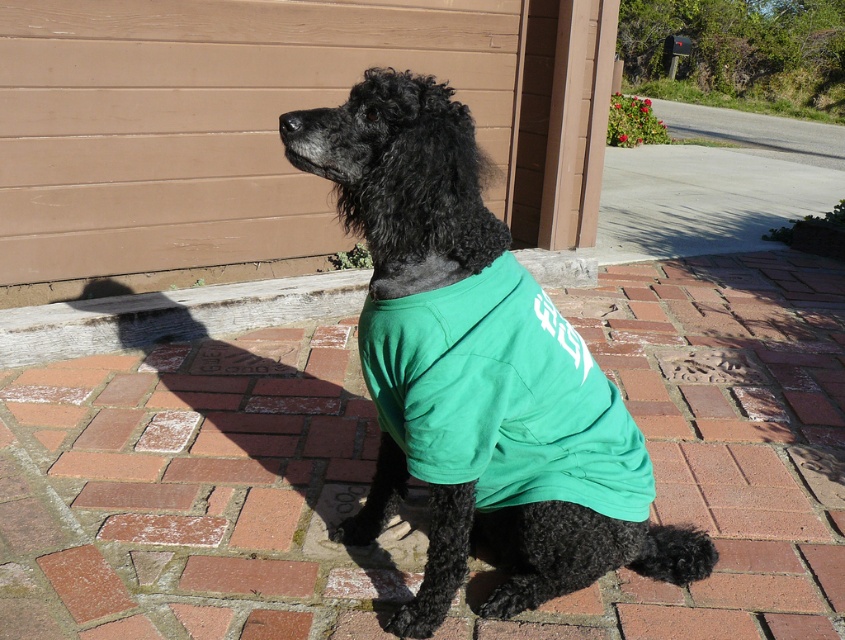
Question: Among these objects, which one is farthest from the camera?

Choices:
 (A) green fabric shirt at center
 (B) shiny black poodle at center

Answer: (A)

Question: Is shiny black poodle at center below green fabric shirt at center?

Choices:
 (A) no
 (B) yes

Answer: (A)

Question: Does shiny black poodle at center lie in front of green fabric shirt at center?

Choices:
 (A) yes
 (B) no

Answer: (A)

Question: Among these objects, which one is farthest from the camera?

Choices:
 (A) shiny black poodle at center
 (B) green fabric shirt at center

Answer: (B)

Question: Which point is farther to the camera?

Choices:
 (A) green fabric shirt at center
 (B) shiny black poodle at center

Answer: (A)

Question: Is shiny black poodle at center wider than green fabric shirt at center?

Choices:
 (A) yes
 (B) no

Answer: (A)